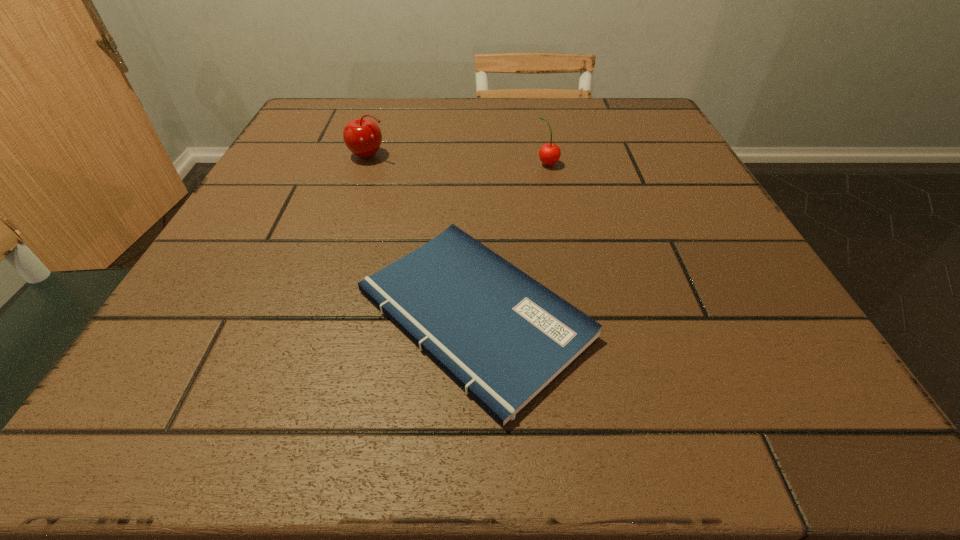
Where is `the leftmost object`? The height and width of the screenshot is (540, 960). the leftmost object is located at coordinates (362, 136).

At what (x,y) coordinates should I click in order to perform the action: click on the right cherry. Please return your answer as a coordinate pair (x, y). The width and height of the screenshot is (960, 540). Looking at the image, I should click on (549, 154).

Identify the location of paperback book. The image size is (960, 540). (501, 335).

Where is `the nearest object`? The height and width of the screenshot is (540, 960). the nearest object is located at coordinates (501, 335).

Where is `vacant area situated on the back of the left cherry`? vacant area situated on the back of the left cherry is located at coordinates (378, 126).

This screenshot has height=540, width=960. What are the coordinates of `free point located on the right of the right cherry` in the screenshot? It's located at [613, 164].

Identify the location of vacant space located on the back of the paperback book. (476, 131).

Where is `object located in the near edge section of the desktop`? The image size is (960, 540). object located in the near edge section of the desktop is located at coordinates (501, 335).

Locate an element on the screen. Image resolution: width=960 pixels, height=540 pixels. object located in the left edge section of the desktop is located at coordinates (362, 136).

Where is `free space at the far edge`? The image size is (960, 540). free space at the far edge is located at coordinates (559, 100).